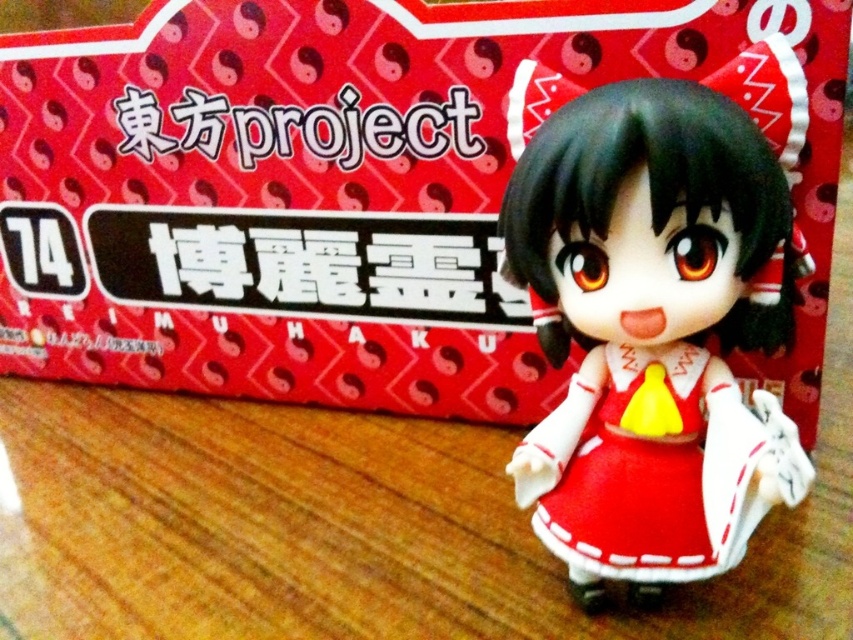
Looking at this image, you are a collector who wants to place a new figurine on your desk. The desk has a rectangular surface with dimensions 0.5 meters by 0.3 meters. The matte red box at center is currently occupying space on the desk. Can you determine if the new figurine will fit on the desk without overlapping the box?

The matte red box at center is located at point (349,188). Since the desk dimensions are 0.5m x 0.3m, the box occupies a specific area. However, without knowing the size of the new figurine and the box, it is impossible to determine if there is enough space. Please provide the dimensions of both items for an accurate assessment.

You are a collector who wants to store the matte red dress at center in a display case. The display case can only accommodate items smaller than the matte red box at center. Can the dress fit inside the case?

The matte red box at center is bigger than the matte red dress at center, so the dress is smaller than the box and can fit inside the display case.